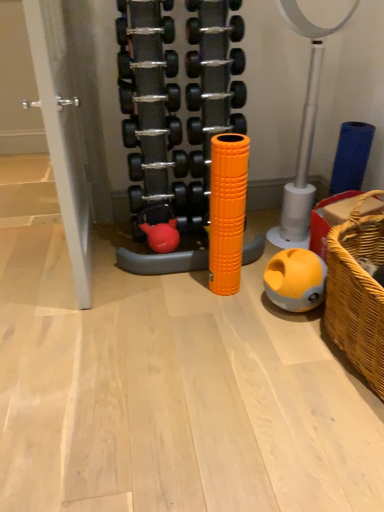
What are the coordinates of `vacant space in front of yellow matte ball at lower right, the 1th toy ordered from the bottom` in the screenshot? It's located at pos(297,338).